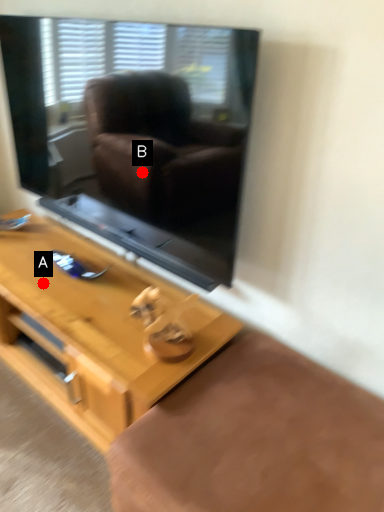
Question: Two points are circled on the image, labeled by A and B beside each circle. Which point appears farthest from the camera in this image?

Choices:
 (A) A is further
 (B) B is further

Answer: (A)